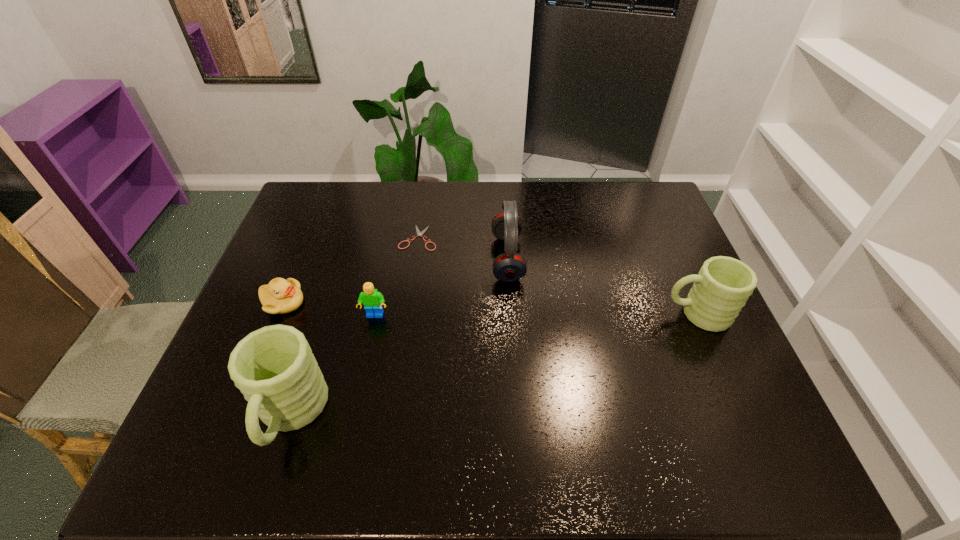
Find the location of a particular element. The image size is (960, 540). vacant space that's between the shears and the fifth object from left to right is located at coordinates (463, 248).

Locate an element on the screen. vacant space that is in between the shortest object and the second object from right to left is located at coordinates (463, 248).

This screenshot has height=540, width=960. I want to click on free space between the right mug and the shears, so click(558, 276).

What are the coordinates of `free space between the fourth tallest object and the second shortest object` in the screenshot? It's located at (329, 309).

What are the coordinates of `vacant area that lies between the fifth object from left to right and the left mug` in the screenshot? It's located at (399, 337).

Where is `free spot between the duckling and the farther mug`? free spot between the duckling and the farther mug is located at coordinates (490, 308).

Image resolution: width=960 pixels, height=540 pixels. I want to click on free spot between the earphone and the Lego, so [442, 287].

At what (x,y) coordinates should I click in order to perform the action: click on free area in between the shears and the duckling. Please return your answer as a coordinate pair (x, y). Looking at the image, I should click on (350, 270).

The image size is (960, 540). What are the coordinates of `free point between the earphone and the duckling` in the screenshot? It's located at (396, 280).

I want to click on object that is the third closest to the duckling, so click(x=419, y=233).